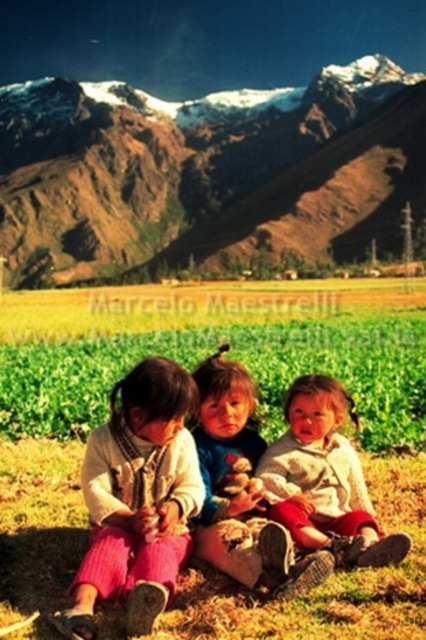
Describe the element at coordinates (138, 499) in the screenshot. I see `matte pink pants at lower left` at that location.

Does matte pink pants at lower left appear on the left side of white knit sweater at center?

Indeed, matte pink pants at lower left is positioned on the left side of white knit sweater at center.

Between point (183, 397) and point (331, 508), which one is positioned in front?

Point (183, 397) is in front.

You are a GUI agent. You are given a task and a screenshot of the screen. Output one action in this format:
    pyautogui.click(x=<x>, y=<y>)
    Task: Click on the matte pink pants at lower left
    The image size is (426, 640).
    Given the screenshot: What is the action you would take?
    pyautogui.click(x=138, y=499)

Does point (183, 193) come behind point (152, 609)?

Yes, point (183, 193) is behind point (152, 609).

Between rugged brown mountain at upper center and matte pink pants at lower left, which one appears on the right side from the viewer's perspective?

Positioned to the right is matte pink pants at lower left.

The image size is (426, 640). I want to click on rugged brown mountain at upper center, so click(x=155, y=156).

Where is `rugged brown mountain at upper center`? This screenshot has height=640, width=426. rugged brown mountain at upper center is located at coordinates 155,156.

Is green grass at center below matte pink pants at lower left?

Incorrect, green grass at center is not positioned below matte pink pants at lower left.

Is the position of green grass at center more distant than that of matte pink pants at lower left?

Yes.

Is point (288, 330) positioned in front of point (172, 536)?

No, (288, 330) is behind (172, 536).

I want to click on green grass at center, so click(233, 333).